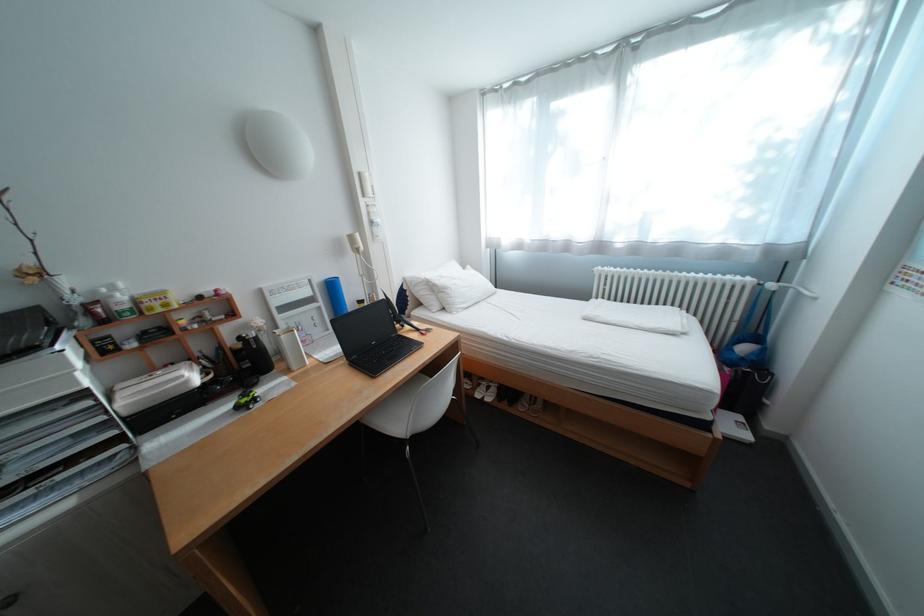
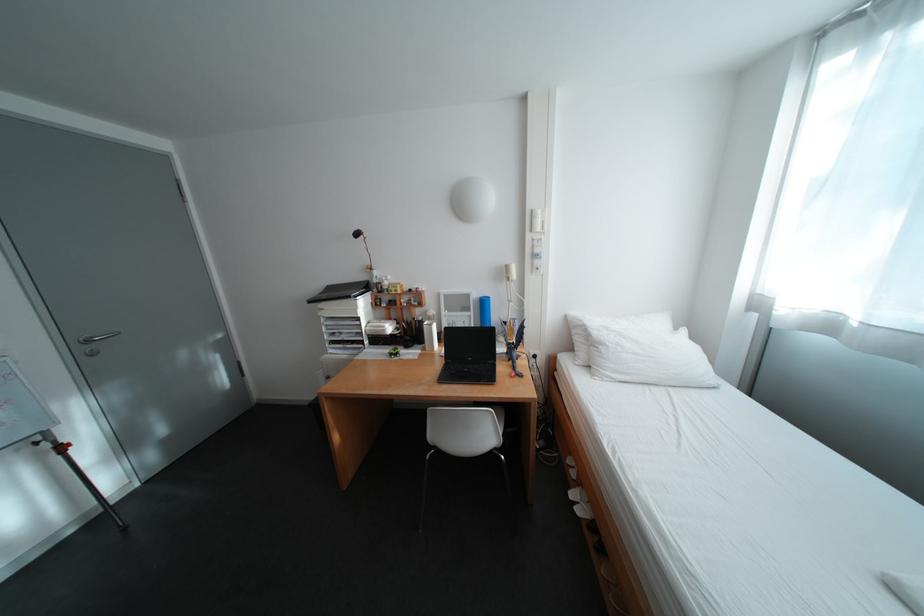
Question: I am providing you with two images of the same scene from different viewpoints. Which of the following objects are not visible in image2?

Choices:
 (A) blue water bottle
 (B) white light switch
 (C) desk lamp head
 (D) none of these

Answer: (D)